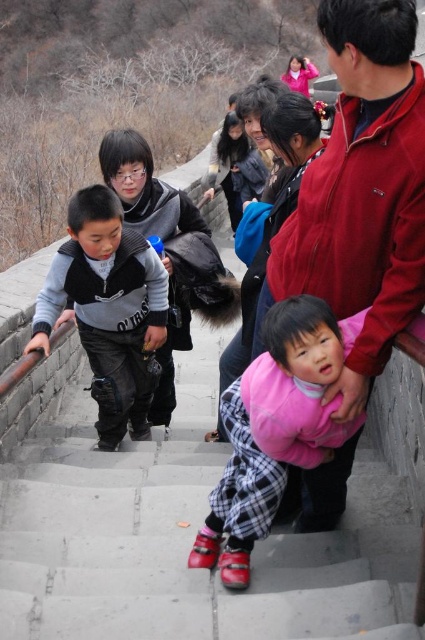
You are a tour guide explaining the historical staircase to visitors. You notice a pink fleece jacket at center and a gray fleece vest at left. Which clothing item is positioned lower on the staircase?

The pink fleece jacket at center is located below the gray fleece vest at left, so it is positioned lower on the staircase.

You are a photographer planning to capture a wide shot of the scene. Given that the smooth concrete stairs at center and the gray fleece vest at left are both in your frame, which object would require more space in the foreground to ensure they are fully visible?

The gray fleece vest at left requires more space in the foreground because it occupies more space than the smooth concrete stairs at center.

You are a photographer planning to take a picture of the smooth concrete stairs at center and the pink fleece jacket at center. Based on their sizes, which object should you focus on first if you want both to be in sharp focus?

The smooth concrete stairs at center has a smaller size compared to the pink fleece jacket at center. To ensure both are in sharp focus, you should focus on the smaller object first, which is the smooth concrete stairs at center.